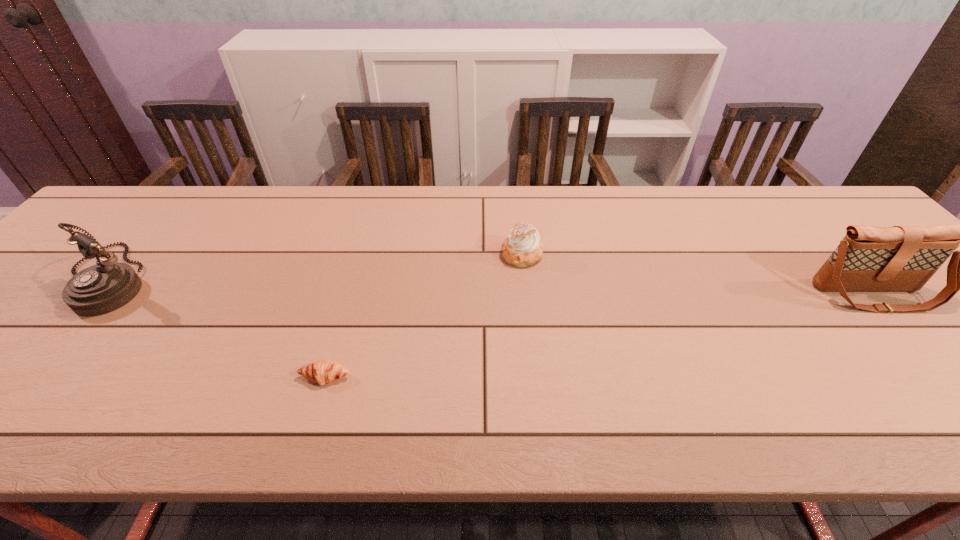
Locate an element on the screen. The image size is (960, 540). the rightmost object is located at coordinates (901, 258).

At what (x,y) coordinates should I click in order to perform the action: click on the tallest object. Please return your answer as a coordinate pair (x, y). The image size is (960, 540). Looking at the image, I should click on (901, 258).

You are a GUI agent. You are given a task and a screenshot of the screen. Output one action in this format:
    pyautogui.click(x=<x>, y=<y>)
    Task: Click on the leftmost object
    This screenshot has width=960, height=540.
    Given the screenshot: What is the action you would take?
    pyautogui.click(x=102, y=288)

You are a GUI agent. You are given a task and a screenshot of the screen. Output one action in this format:
    pyautogui.click(x=<x>, y=<y>)
    Task: Click on the third shortest object
    
    Given the screenshot: What is the action you would take?
    point(102,288)

The image size is (960, 540). Find the location of `the farther pastry`. the farther pastry is located at coordinates (522, 248).

Image resolution: width=960 pixels, height=540 pixels. Identify the location of the right pastry. (522, 248).

You are a GUI agent. You are given a task and a screenshot of the screen. Output one action in this format:
    pyautogui.click(x=<x>, y=<y>)
    Task: Click on the shorter pastry
    
    Given the screenshot: What is the action you would take?
    pyautogui.click(x=322, y=371)

You are a GUI agent. You are given a task and a screenshot of the screen. Output one action in this format:
    pyautogui.click(x=<x>, y=<y>)
    Task: Click on the shortest object
    The width and height of the screenshot is (960, 540).
    Given the screenshot: What is the action you would take?
    pyautogui.click(x=322, y=371)

The image size is (960, 540). Identify the location of free space located on the front-facing side of the rightmost object. (958, 391).

Where is `vacant space located on the back of the telephone`? vacant space located on the back of the telephone is located at coordinates (169, 212).